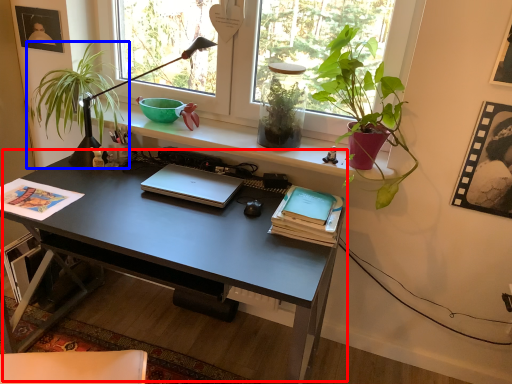
Question: Which point is closer to the camera, desk (highlighted by a red box) or houseplant (highlighted by a blue box)?

Choices:
 (A) desk
 (B) houseplant

Answer: (A)